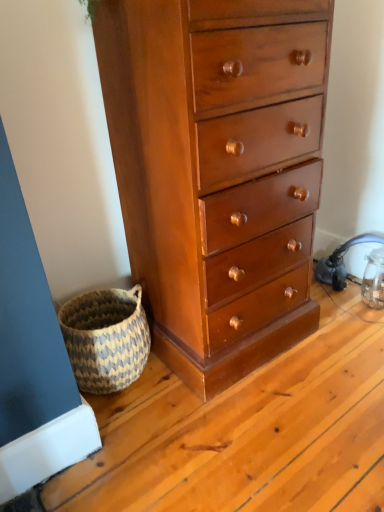
Question: Is point (84, 307) positioned closer to the camera than point (311, 76)?

Choices:
 (A) farther
 (B) closer

Answer: (A)

Question: In the image, is natural woven basket at lower left on the left side or the right side of shiny brown wood chest of drawers at center?

Choices:
 (A) right
 (B) left

Answer: (B)

Question: Is natural woven basket at lower left in front of or behind shiny brown wood chest of drawers at center in the image?

Choices:
 (A) behind
 (B) front

Answer: (A)

Question: Choose the correct answer: Is shiny brown wood chest of drawers at center inside natural woven basket at lower left or outside it?

Choices:
 (A) inside
 (B) outside

Answer: (B)

Question: Is shiny brown wood chest of drawers at center in front of or behind natural woven basket at lower left in the image?

Choices:
 (A) behind
 (B) front

Answer: (B)

Question: Visually, is shiny brown wood chest of drawers at center positioned to the left or to the right of natural woven basket at lower left?

Choices:
 (A) left
 (B) right

Answer: (B)

Question: Considering the positions of point (152, 27) and point (84, 294), is point (152, 27) closer or farther from the camera than point (84, 294)?

Choices:
 (A) closer
 (B) farther

Answer: (A)